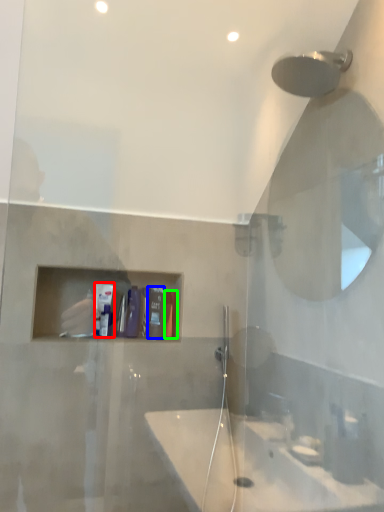
Question: Based on their relative distances, which object is nearer to toiletry (highlighted by a red box)? Choose from toiletry (highlighted by a blue box) and toiletry (highlighted by a green box).

Choices:
 (A) toiletry
 (B) toiletry

Answer: (A)